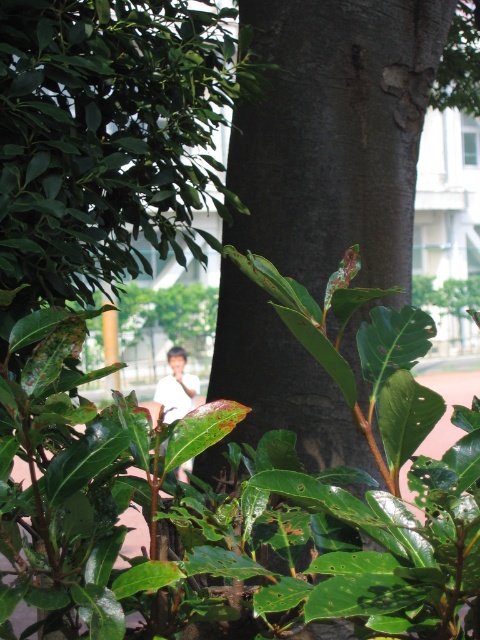
Who is lower down, dark brown rough tree trunk at center or white matte shirt at center?

white matte shirt at center is lower down.

Describe the element at coordinates (336, 132) in the screenshot. I see `dark brown rough tree trunk at center` at that location.

Locate an element on the screen. This screenshot has height=640, width=480. dark brown rough tree trunk at center is located at coordinates (336, 132).